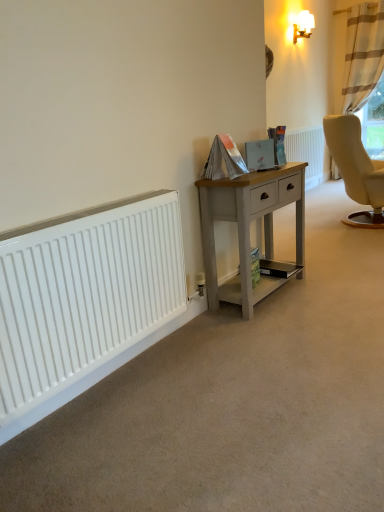
The width and height of the screenshot is (384, 512). What are the coordinates of `free spot to the right of light gray wood desk at center` in the screenshot? It's located at (331, 288).